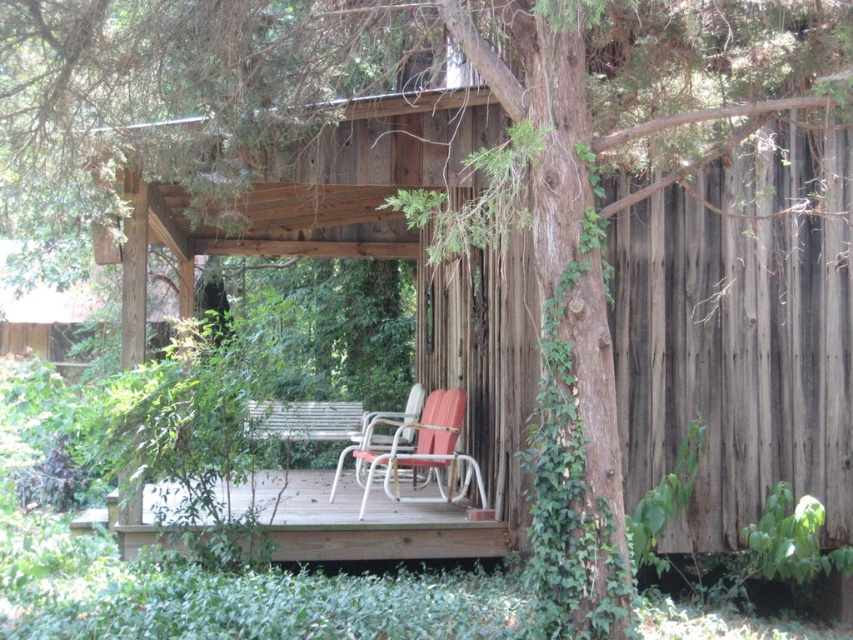
Does metallic orange chair at center appear under metallic silver chair at center?

Indeed, metallic orange chair at center is positioned under metallic silver chair at center.

Can you confirm if metallic orange chair at center is smaller than metallic silver chair at center?

Actually, metallic orange chair at center might be larger than metallic silver chair at center.

Is point (428, 465) positioned before point (392, 440)?

Yes.

Locate an element on the screen. metallic orange chair at center is located at coordinates [421, 449].

Based on the photo, is wooden deck at center below metallic orange chair at center?

Correct, wooden deck at center is located below metallic orange chair at center.

This screenshot has width=853, height=640. What are the coordinates of `wooden deck at center` in the screenshot? It's located at (363, 522).

You are a GUI agent. You are given a task and a screenshot of the screen. Output one action in this format:
    pyautogui.click(x=<x>, y=<y>)
    Task: Click on the wooden deck at center
    The image size is (853, 640).
    Given the screenshot: What is the action you would take?
    pyautogui.click(x=363, y=522)

You are a GUI agent. You are given a task and a screenshot of the screen. Output one action in this format:
    pyautogui.click(x=<x>, y=<y>)
    Task: Click on the wooden deck at center
    
    Given the screenshot: What is the action you would take?
    pyautogui.click(x=363, y=522)

Can you confirm if wooden deck at center is smaller than metallic silver chair at center?

No, wooden deck at center is not smaller than metallic silver chair at center.

Does wooden deck at center come behind metallic silver chair at center?

No, wooden deck at center is closer to the viewer.

Measure the distance between point (268, 483) and camera.

Point (268, 483) and camera are 10.83 meters apart.

The image size is (853, 640). In order to click on wooden deck at center in this screenshot , I will do `click(363, 522)`.